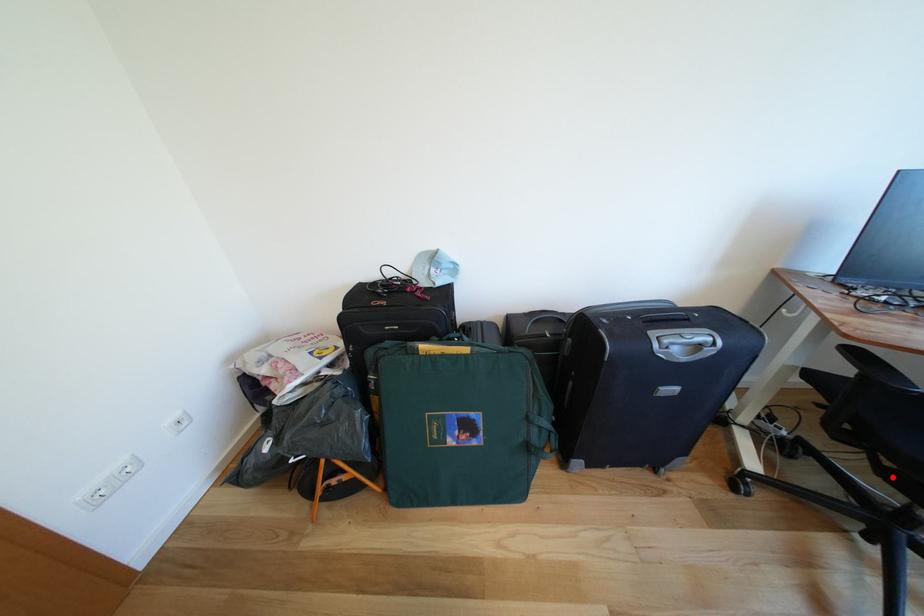
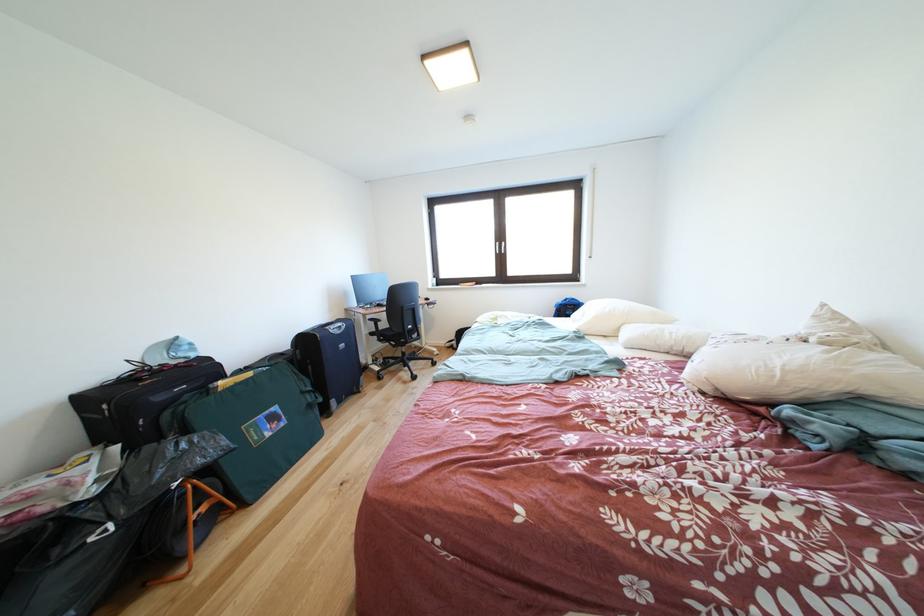
Where in the second image is the point corresponding to the highlighted location from the first image?

(403, 351)